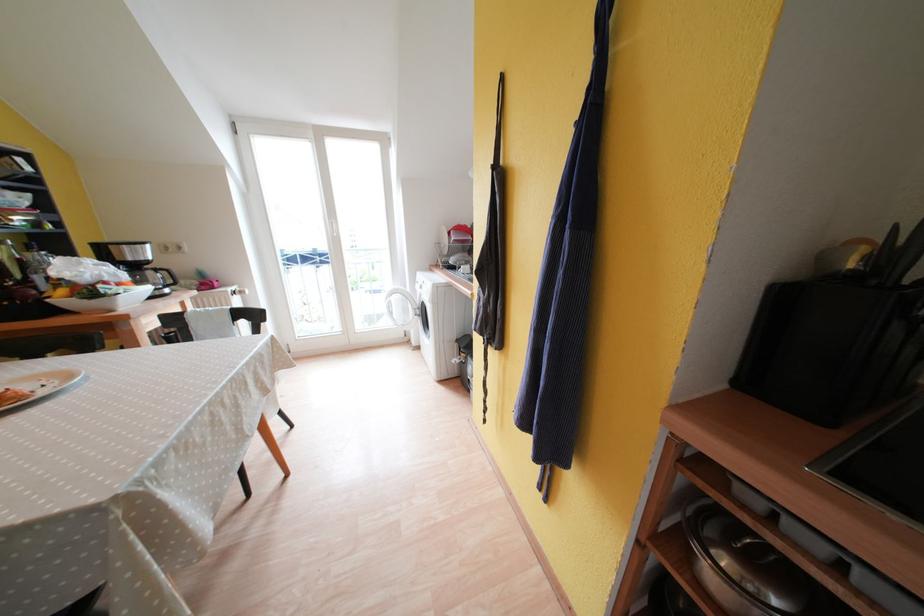
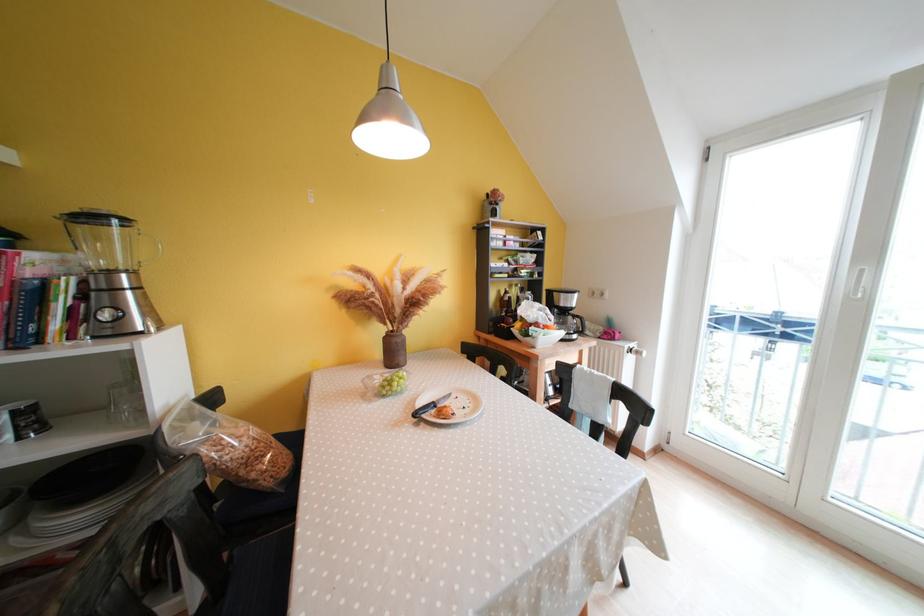
Question: Based on the continuous images, in which direction is the camera rotating? Reply with the corresponding letter.

Choices:
 (A) Left
 (B) Right
 (C) Up
 (D) Down

Answer: (A)